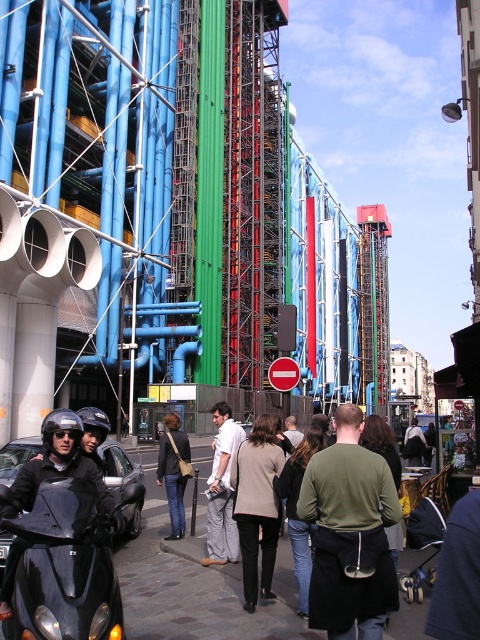
You are a photographer standing on the sidewalk capturing the vibrant building with your camera. You notice two people in the frame wearing a white cotton shirt at center and a denim jacket at center. From your perspective, which clothing item is closer to you?

The white cotton shirt at center is closer to you because it is in front of the denim jacket at center.